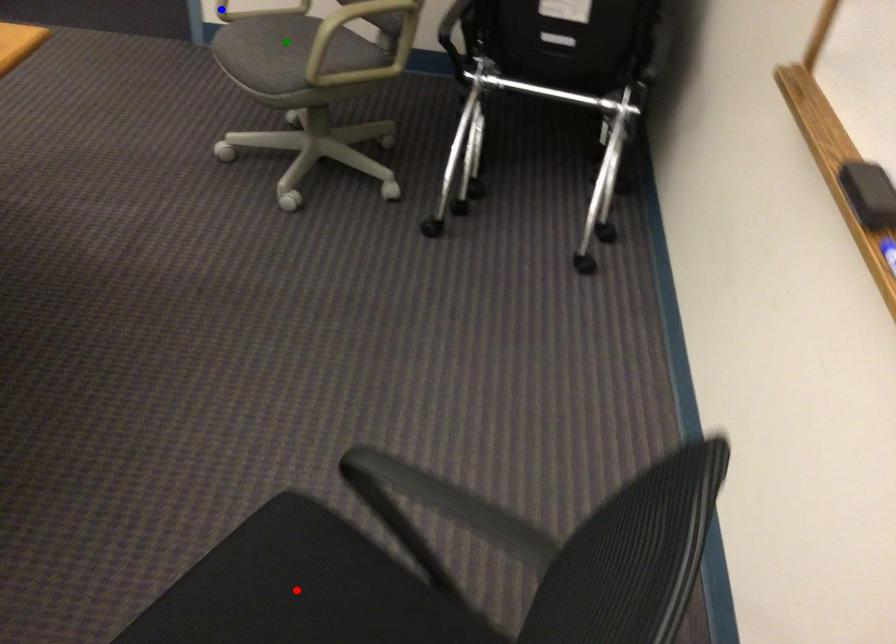
Order these from nearest to farthest:
A) green point
B) blue point
C) red point

blue point, green point, red point